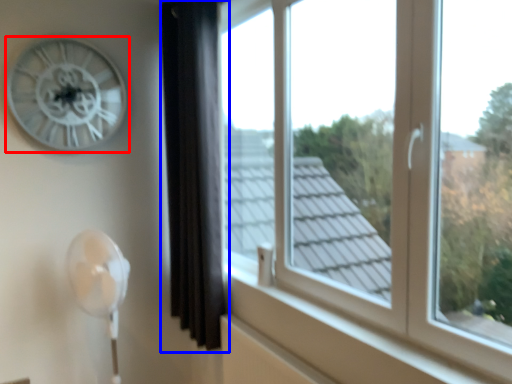
Question: Which object appears farthest to the camera in this image, wall clock (highlighted by a red box) or curtain (highlighted by a blue box)?

Choices:
 (A) wall clock
 (B) curtain

Answer: (A)